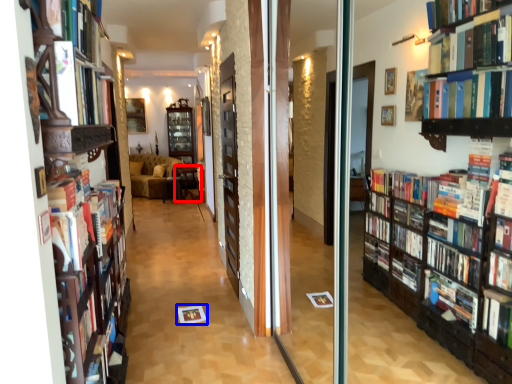
Question: Which object is closer to the camera taking this photo, furniture (highlighted by a red box) or paperback book (highlighted by a blue box)?

Choices:
 (A) furniture
 (B) paperback book

Answer: (B)